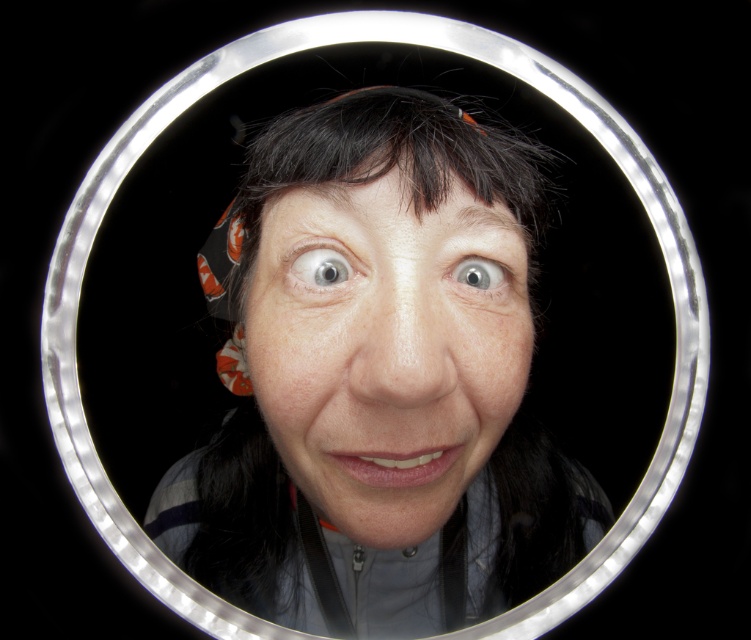
Is smooth skin face at center to the left of gray matte eye at center from the viewer's perspective?

Yes, smooth skin face at center is to the left of gray matte eye at center.

Is smooth skin face at center above gray matte eye at center?

No, smooth skin face at center is not above gray matte eye at center.

Who is more distant from viewer, (433, 321) or (480, 257)?

Point (480, 257)

In order to click on smooth skin face at center in this screenshot , I will do `click(385, 349)`.

Is smooth skin face at center wider than light blue glossy eye at upper center?

Correct, the width of smooth skin face at center exceeds that of light blue glossy eye at upper center.

Which is more to the left, smooth skin face at center or light blue glossy eye at upper center?

light blue glossy eye at upper center is more to the left.

Does point (391, 532) come farther from viewer compared to point (321, 257)?

Yes, it is behind point (321, 257).

Find the location of a particular element. The image size is (751, 640). smooth skin face at center is located at coordinates (385, 349).

How far apart are light blue glossy eye at upper center and gray matte eye at center?

2.92 inches

Who is positioned more to the right, light blue glossy eye at upper center or gray matte eye at center?

Positioned to the right is gray matte eye at center.

I want to click on light blue glossy eye at upper center, so click(321, 268).

Identify the location of light blue glossy eye at upper center. The width and height of the screenshot is (751, 640). (321, 268).